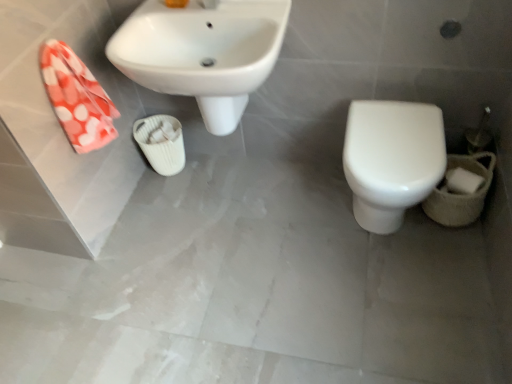
The width and height of the screenshot is (512, 384). Describe the element at coordinates (462, 181) in the screenshot. I see `white matte toilet paper at lower right` at that location.

In order to click on white ribbed cup at center in this screenshot , I will do `click(161, 143)`.

Image resolution: width=512 pixels, height=384 pixels. Describe the element at coordinates (392, 159) in the screenshot. I see `white glossy toilet at lower right` at that location.

From the picture: What is the approximate height of white glossy toilet at lower right?

white glossy toilet at lower right is 18.13 inches tall.

Measure the distance between point (211,77) and camera.

Point (211,77) is 1.35 meters away from camera.

What do you see at coordinates (77, 98) in the screenshot?
I see `orange polka dot fabric at left` at bounding box center [77, 98].

Where is `white matte toilet paper at lower right`? white matte toilet paper at lower right is located at coordinates (462, 181).

Are white glossy sink at upper left and orange polka dot fabric at left located far from each other?

Actually, white glossy sink at upper left and orange polka dot fabric at left are a little close together.

How many degrees apart are the facing directions of white glossy sink at upper left and orange polka dot fabric at left?

1.37 degrees separate the facing orientations of white glossy sink at upper left and orange polka dot fabric at left.

From a real-world perspective, is white glossy sink at upper left over orange polka dot fabric at left?

Actually, white glossy sink at upper left is physically below orange polka dot fabric at left in the real world.

Between white glossy sink at upper left and orange polka dot fabric at left, which one has smaller width?

Thinner between the two is orange polka dot fabric at left.

Where is `sink in front of the white matte toilet paper at lower right`? This screenshot has height=384, width=512. sink in front of the white matte toilet paper at lower right is located at coordinates (203, 53).

In the image, is white glossy sink at upper left positioned in front of or behind white matte toilet paper at lower right?

Clearly, white glossy sink at upper left is in front of white matte toilet paper at lower right.

From the image's perspective, is white glossy sink at upper left located above or below white matte toilet paper at lower right?

Clearly, from the image's perspective, white glossy sink at upper left is above white matte toilet paper at lower right.

Can you confirm if orange polka dot fabric at left is thinner than white glossy toilet at lower right?

Correct, the width of orange polka dot fabric at left is less than that of white glossy toilet at lower right.

Between orange polka dot fabric at left and white glossy toilet at lower right, which one has less height?

Standing shorter between the two is orange polka dot fabric at left.

From the image's perspective, is orange polka dot fabric at left under white glossy toilet at lower right?

No, from the image's perspective, orange polka dot fabric at left is not beneath white glossy toilet at lower right.

Between orange polka dot fabric at left and white glossy toilet at lower right, which one is positioned in front?

Positioned in front is orange polka dot fabric at left.

Can you tell me how much white glossy toilet at lower right and white matte toilet paper at lower right differ in facing direction?

1.37 degrees separate the facing orientations of white glossy toilet at lower right and white matte toilet paper at lower right.

Is white glossy toilet at lower right bigger or smaller than white matte toilet paper at lower right?

In the image, white glossy toilet at lower right appears to be larger than white matte toilet paper at lower right.

Which point is more distant from viewer, (379, 180) or (467, 182)?

The point (467, 182) is farther from the camera.

Is the depth of white glossy toilet at lower right less than that of white matte toilet paper at lower right?

Yes.

Considering their positions, is white matte toilet paper at lower right located in front of or behind white glossy sink at upper left?

white matte toilet paper at lower right is positioned farther from the viewer than white glossy sink at upper left.

Would you say white matte toilet paper at lower right is to the left or to the right of white glossy sink at upper left in the picture?

white matte toilet paper at lower right is to the right of white glossy sink at upper left.

Does point (465, 185) appear closer or farther from the camera than point (245, 42)?

Point (465, 185) is positioned farther from the camera compared to point (245, 42).

Is white matte toilet paper at lower right oriented towards white glossy sink at upper left?

No, white matte toilet paper at lower right is not aimed at white glossy sink at upper left.

Consider the image. Considering the relative sizes of orange polka dot fabric at left and white glossy sink at upper left in the image provided, is orange polka dot fabric at left thinner than white glossy sink at upper left?

Correct, the width of orange polka dot fabric at left is less than that of white glossy sink at upper left.

From a real-world perspective, between orange polka dot fabric at left and white glossy sink at upper left, who is vertically lower?

white glossy sink at upper left.

Is orange polka dot fabric at left to the right of white glossy sink at upper left from the viewer's perspective?

No, orange polka dot fabric at left is not to the right of white glossy sink at upper left.

Considering their positions, is white ribbed cup at center located in front of or behind white glossy sink at upper left?

white ribbed cup at center is behind white glossy sink at upper left.

Is white ribbed cup at center taller than white glossy sink at upper left?

No.

In order to click on sink in front of the white ribbed cup at center in this screenshot , I will do `click(203, 53)`.

Would you say white ribbed cup at center contains white glossy sink at upper left?

Definitely not — white glossy sink at upper left is not inside white ribbed cup at center.

Locate an element on the screen. This screenshot has height=384, width=512. hand towel lying below the white glossy sink at upper left (from the image's perspective) is located at coordinates (77, 98).

Where is `sink in front of the white matte toilet paper at lower right`? The image size is (512, 384). sink in front of the white matte toilet paper at lower right is located at coordinates (203, 53).

Based on their spatial positions, is white ribbed cup at center or white matte toilet paper at lower right further from orange polka dot fabric at left?

white matte toilet paper at lower right is positioned further to the anchor orange polka dot fabric at left.

Considering their positions, is orange polka dot fabric at left positioned closer to white glossy toilet at lower right than white glossy sink at upper left?

white glossy sink at upper left is closer to white glossy toilet at lower right.

Looking at the image, which one is located closer to white glossy toilet at lower right, white glossy sink at upper left or white matte toilet paper at lower right?

white matte toilet paper at lower right is closer to white glossy toilet at lower right.

When comparing their distances from orange polka dot fabric at left, does white glossy toilet at lower right or white ribbed cup at center seem further?

white glossy toilet at lower right.

When comparing their distances from white glossy toilet at lower right, does orange polka dot fabric at left or white ribbed cup at center seem further?

orange polka dot fabric at left lies further to white glossy toilet at lower right than the other object.

Based on their spatial positions, is white glossy sink at upper left or white glossy toilet at lower right further from white matte toilet paper at lower right?

white glossy sink at upper left is further to white matte toilet paper at lower right.

When comparing their distances from white ribbed cup at center, does white matte toilet paper at lower right or orange polka dot fabric at left seem further?

white matte toilet paper at lower right is positioned further to the anchor white ribbed cup at center.

Based on their spatial positions, is white ribbed cup at center or white glossy sink at upper left further from orange polka dot fabric at left?

The object further to orange polka dot fabric at left is white ribbed cup at center.

In order to click on porcelain located between orange polka dot fabric at left and white glossy toilet at lower right in the left-right direction in this screenshot , I will do `click(161, 143)`.

You are a GUI agent. You are given a task and a screenshot of the screen. Output one action in this format:
    pyautogui.click(x=<x>, y=<y>)
    Task: Click on the toilet between white glossy sink at upper left and white matte toilet paper at lower right from left to right
    This screenshot has width=512, height=384.
    Given the screenshot: What is the action you would take?
    [x=392, y=159]

You are a GUI agent. You are given a task and a screenshot of the screen. Output one action in this format:
    pyautogui.click(x=<x>, y=<y>)
    Task: Click on the sink between white ribbed cup at center and white glossy toilet at lower right in the horizontal direction
    
    Given the screenshot: What is the action you would take?
    pyautogui.click(x=203, y=53)

Find the location of a particular element. porcelain located between orange polka dot fabric at left and white matte toilet paper at lower right in the left-right direction is located at coordinates (161, 143).